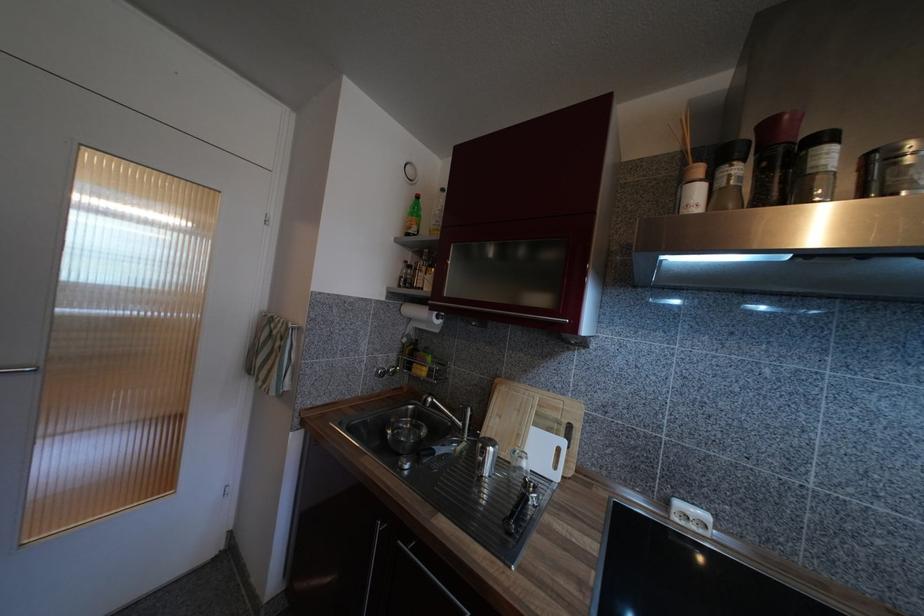
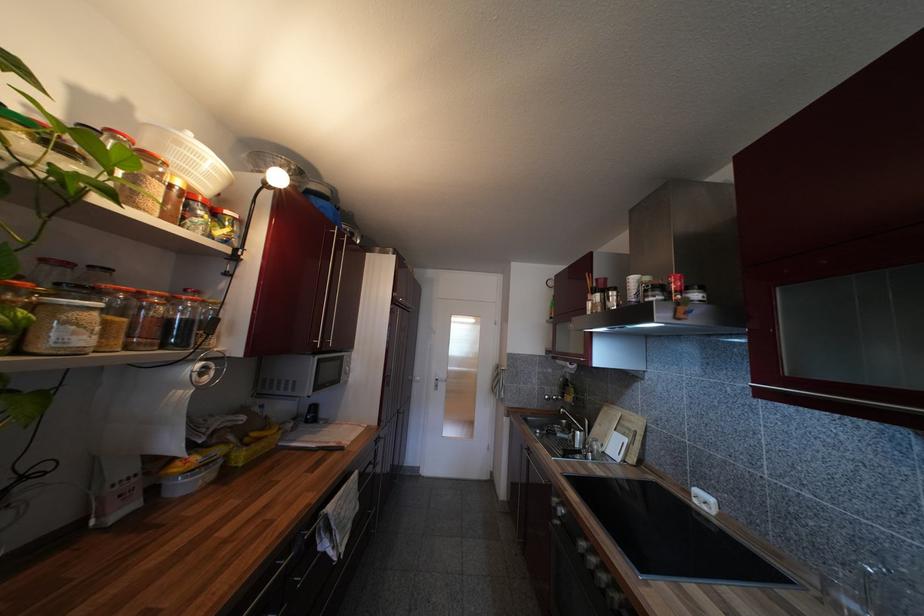
In the second image, find the point that corresponds to [523,438] in the first image.

(610, 438)